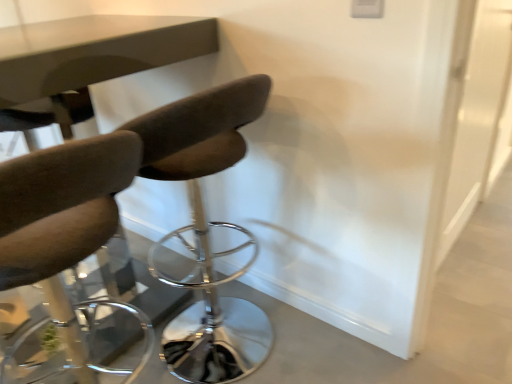
At what (x,y) coordinates should I click in order to perform the action: click on vacant space underneath transparent glass door at right (from a real-world perspective). Please return your answer as a coordinate pair (x, y). Image resolution: width=512 pixels, height=384 pixels. Looking at the image, I should click on (473, 221).